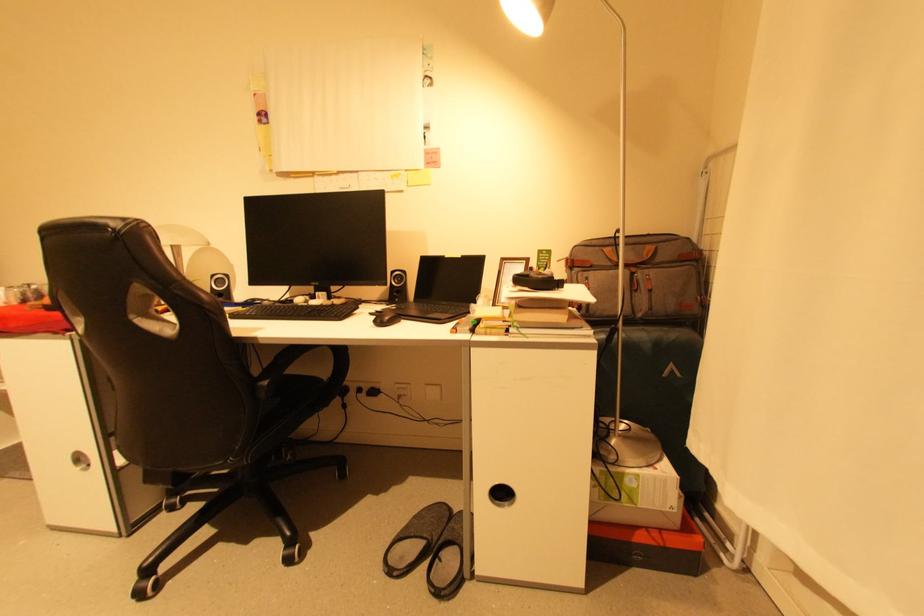
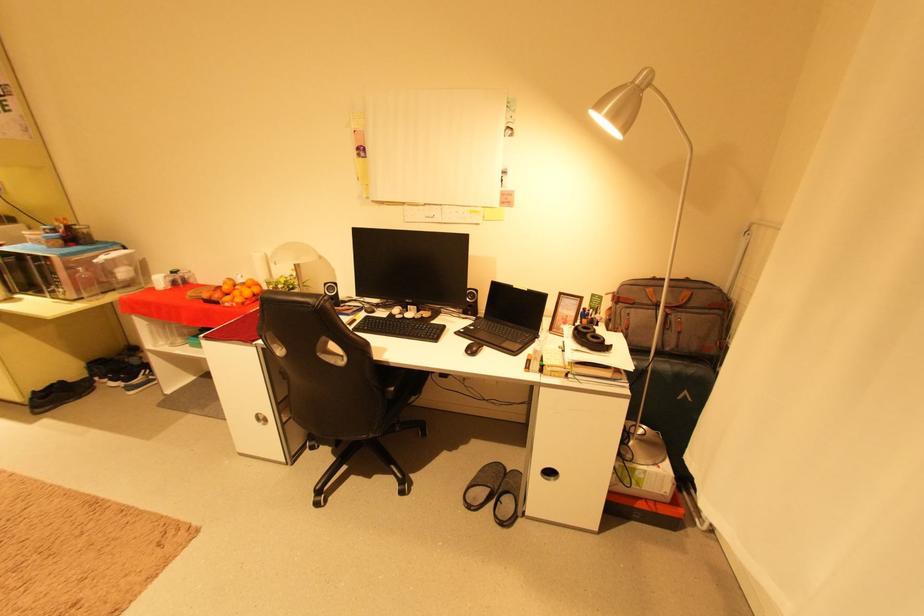
Where in the second image is the point corresponding to pixel 442 543 from the first image?

(504, 492)